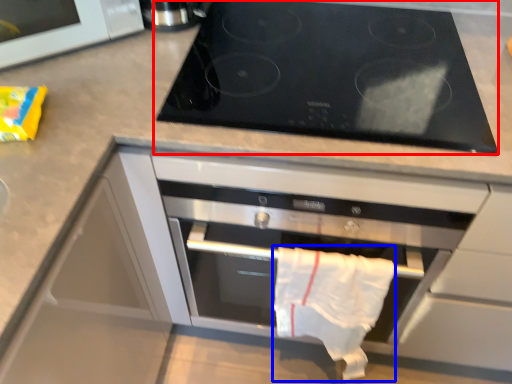
Question: Which object is further to the camera taking this photo, gas stove (highlighted by a red box) or cloth (highlighted by a blue box)?

Choices:
 (A) gas stove
 (B) cloth

Answer: (B)